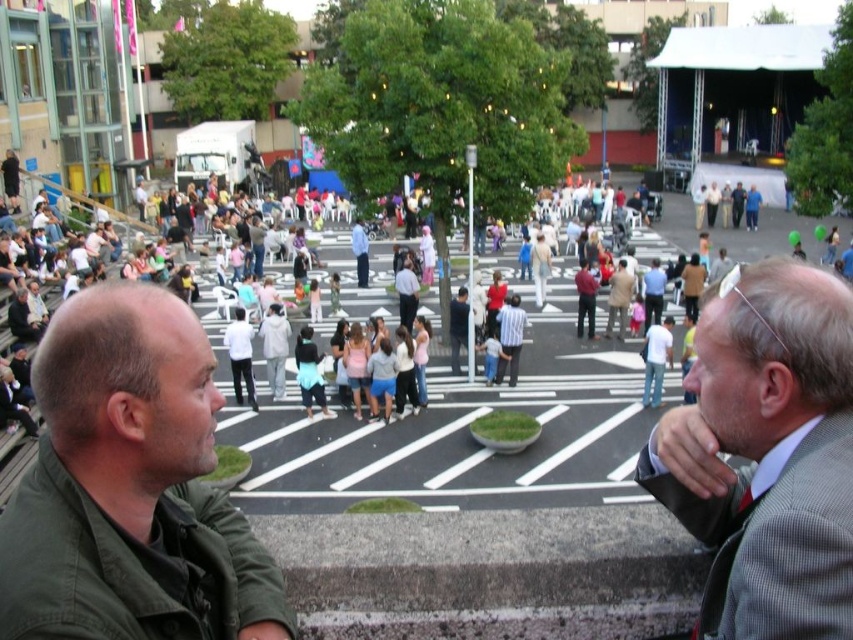
Who is more distant from viewer, (115, 400) or (838, 401)?

The point (838, 401) is behind.

Which is in front, point (212, 618) or point (671, 484)?

Positioned in front is point (212, 618).

Locate an element on the screen. The image size is (853, 640). green matte jacket at lower left is located at coordinates (131, 486).